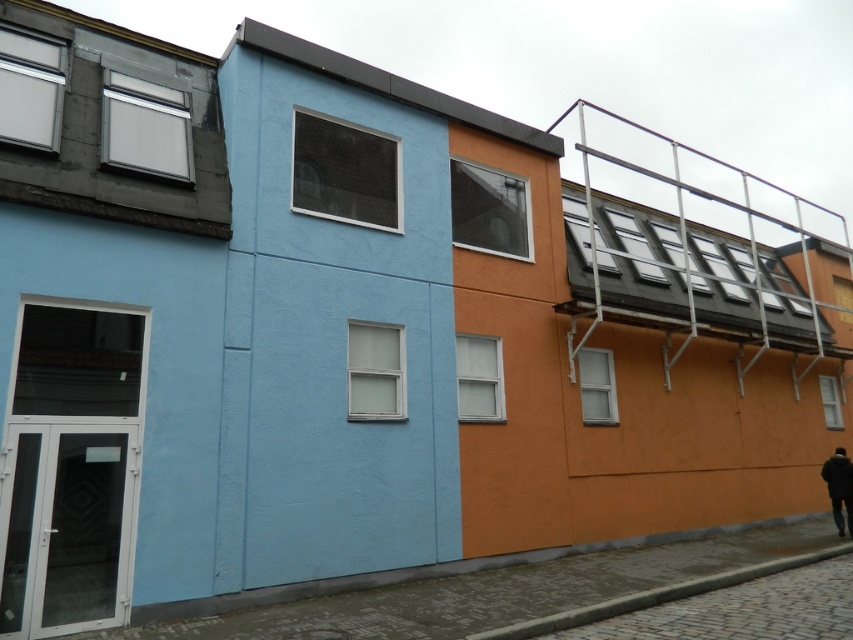
Question: Can you confirm if metallic silver rail at upper right is smaller than dark blue jacket at lower right?

Choices:
 (A) no
 (B) yes

Answer: (A)

Question: From the image, what is the correct spatial relationship of metallic silver rail at upper right in relation to dark blue jacket at lower right?

Choices:
 (A) below
 (B) above

Answer: (B)

Question: Among these objects, which one is farthest from the camera?

Choices:
 (A) metallic silver rail at upper right
 (B) dark blue jacket at lower right

Answer: (B)

Question: Which point is closer to the camera?

Choices:
 (A) metallic silver rail at upper right
 (B) dark blue jacket at lower right

Answer: (A)

Question: Is the position of metallic silver rail at upper right more distant than that of dark blue jacket at lower right?

Choices:
 (A) no
 (B) yes

Answer: (A)

Question: Which point appears closest to the camera in this image?

Choices:
 (A) (811, 316)
 (B) (833, 456)

Answer: (B)